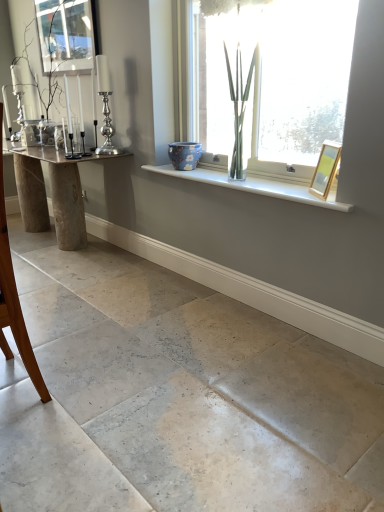
Where is `free space in front of blue glossy vase at center`? The height and width of the screenshot is (512, 384). free space in front of blue glossy vase at center is located at coordinates (196, 172).